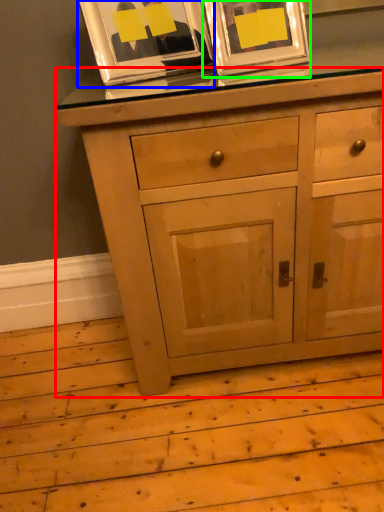
Question: Based on their relative distances, which object is farther from chest of drawers (highlighted by a red box)? Choose from picture frame (highlighted by a blue box) and picture frame (highlighted by a green box).

Choices:
 (A) picture frame
 (B) picture frame

Answer: (A)